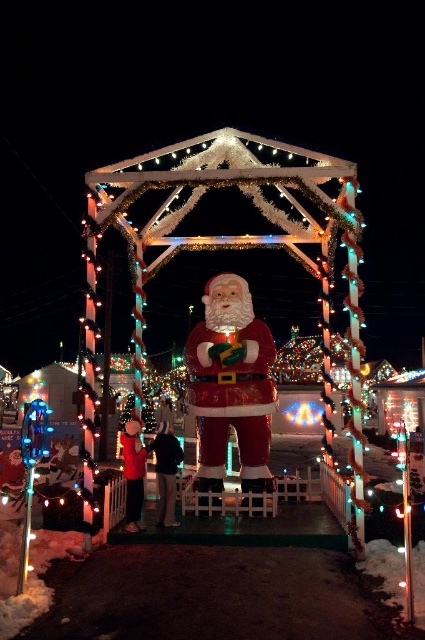
You are a delivery robot with a 1.2 meter wide package. You need to navigate between the shiny plastic santa at center and the red glossy santa claus at center to deliver the package. Can you fit through the space between them?

The distance between the shiny plastic santa at center and the red glossy santa claus at center is 1.18 meters. Since the package is 1.2 meters wide, it is slightly wider than the available space, so the robot cannot fit through the space between them.

You are standing at the origin point of the coordinate system in the image. Where is the shiny plastic santa at center located in terms of coordinates?

The shiny plastic santa at center is located at coordinates point (234, 246).